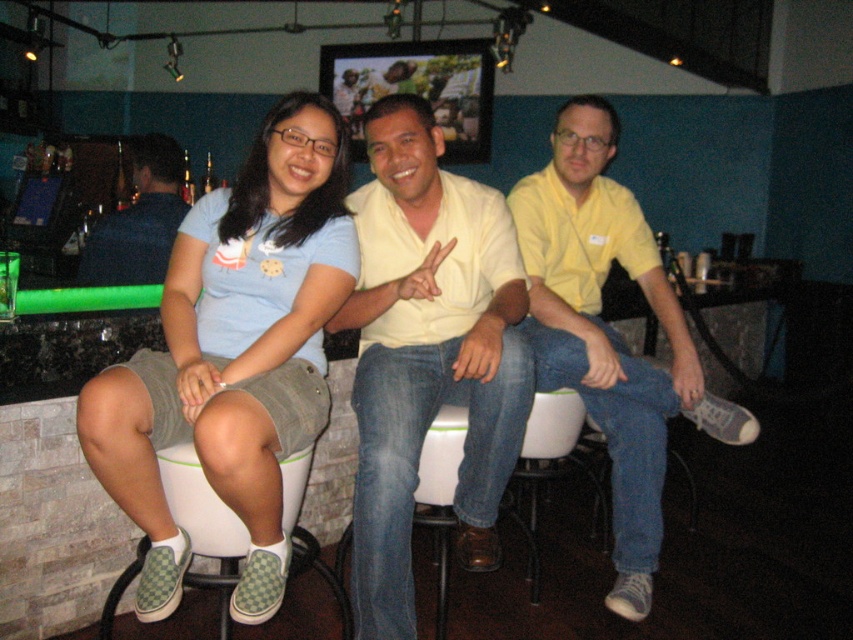
You are a photographer trying to capture a group photo of the matte yellow shirt at center and the white rubber bar stool at lower left. Based on their heights, which one should you focus on to ensure both are in frame without needing to adjust your camera angle?

The matte yellow shirt at center is much taller than the white rubber bar stool at lower left, so focusing on the matte yellow shirt at center will ensure both are in frame without needing to adjust your camera angle.

You are a photographer trying to capture a group photo of the matte yellow shirt at center and the white rubber bar stool at lower left. Based on their positions, which object is located to the right of the other?

The matte yellow shirt at center is positioned on the right side of white rubber bar stool at lower left.

You are standing in the room and want to sit on the white rubber bar stool at lower left. Which direction should you move relative to the dark blue shirt at left?

The white rubber bar stool at lower left is to the right of the dark blue shirt at left, so you should move to the right side of the dark blue shirt at left to sit on it.